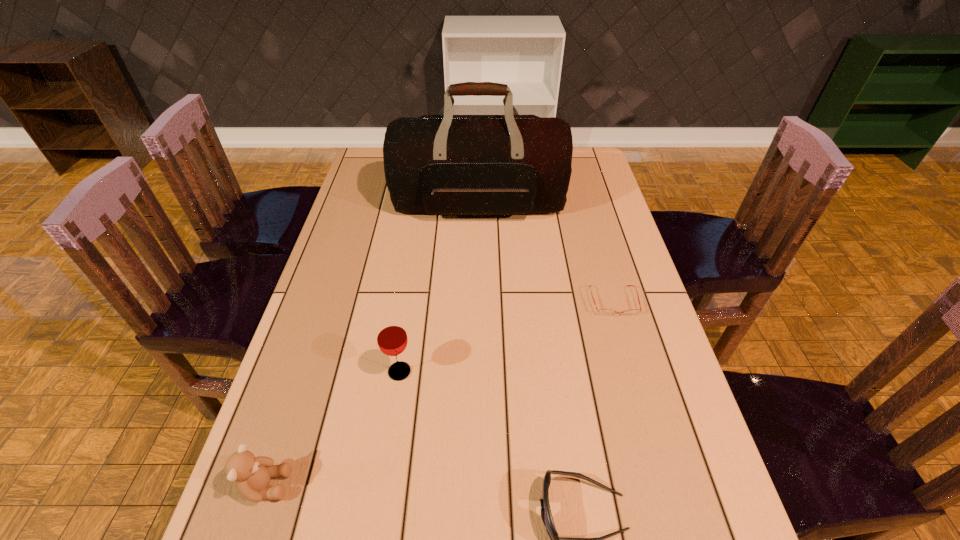
This screenshot has width=960, height=540. Identify the location of vacant space located on the face of the teddy bear. (397, 485).

Locate an element on the screen. Image resolution: width=960 pixels, height=540 pixels. free space located on the lenses of the rightmost object is located at coordinates (645, 410).

The height and width of the screenshot is (540, 960). I want to click on duffel bag that is at the left edge, so click(445, 164).

The image size is (960, 540). I want to click on teddy bear at the left edge, so click(252, 474).

Where is `object that is at the right edge`? object that is at the right edge is located at coordinates click(x=605, y=312).

The height and width of the screenshot is (540, 960). What are the coordinates of `vacant space at the left edge of the desktop` in the screenshot? It's located at (369, 256).

Where is `vacant area at the right edge of the desktop`? The height and width of the screenshot is (540, 960). vacant area at the right edge of the desktop is located at coordinates (637, 484).

In the image, there is a desktop. Where is `free space at the far left corner`? Image resolution: width=960 pixels, height=540 pixels. free space at the far left corner is located at coordinates (378, 169).

Image resolution: width=960 pixels, height=540 pixels. Find the location of `free spot between the teddy bear and the shortest object`. free spot between the teddy bear and the shortest object is located at coordinates (440, 393).

Where is `unoccupied area between the teddy bear and the second farthest object`? The image size is (960, 540). unoccupied area between the teddy bear and the second farthest object is located at coordinates click(x=440, y=393).